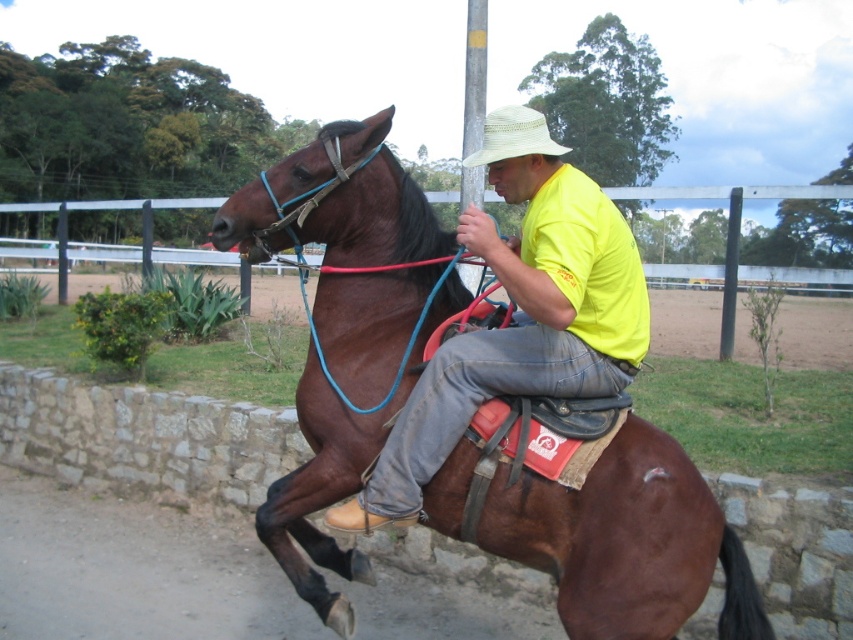
Question: Is shiny brown horse at center above yellow matte shirt at center?

Choices:
 (A) no
 (B) yes

Answer: (A)

Question: Which point is closer to the camera?

Choices:
 (A) (462, 161)
 (B) (454, 276)
 (C) (389, 508)

Answer: (C)

Question: Which point is farther to the camera?

Choices:
 (A) natural straw cowboy hat at center
 (B) shiny brown horse at center

Answer: (B)

Question: Which of these objects is positioned farthest from the natural straw cowboy hat at center?

Choices:
 (A) yellow matte shirt at center
 (B) shiny brown horse at center

Answer: (B)

Question: Does shiny brown horse at center have a smaller size compared to yellow matte shirt at center?

Choices:
 (A) yes
 (B) no

Answer: (A)

Question: Does shiny brown horse at center appear over yellow matte shirt at center?

Choices:
 (A) yes
 (B) no

Answer: (B)